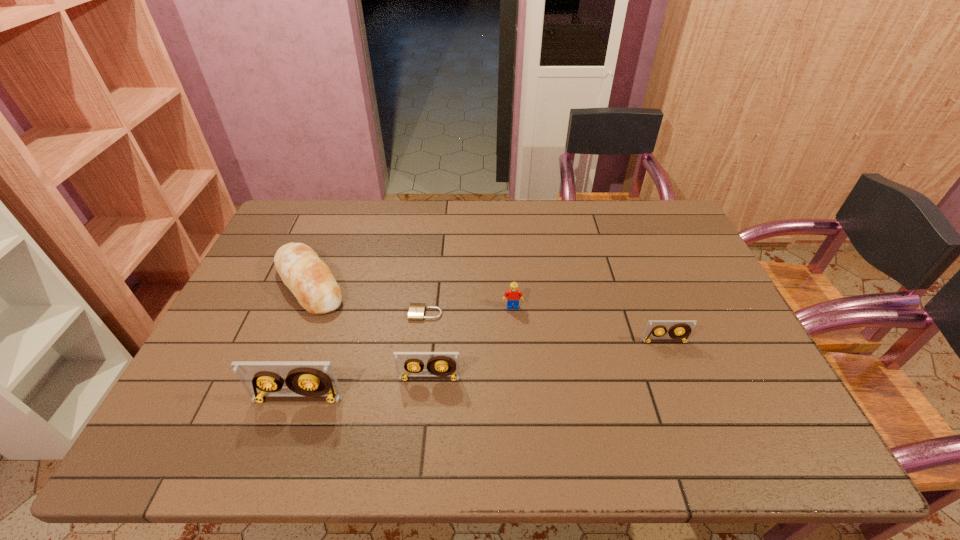
Locate an element on the screen. The image size is (960, 540). the leftmost videotape is located at coordinates click(x=306, y=380).

Identify the location of the tallest videotape. The height and width of the screenshot is (540, 960). (306, 380).

Locate an element on the screen. The image size is (960, 540). the second nearest videotape is located at coordinates (441, 365).

Locate an element on the screen. The height and width of the screenshot is (540, 960). the fifth farthest object is located at coordinates (441, 365).

Find the location of a particular element. This screenshot has height=540, width=960. the rightmost videotape is located at coordinates (679, 329).

At what (x,y) coordinates should I click in order to perform the action: click on the rightmost object. Please return your answer as a coordinate pair (x, y). Looking at the image, I should click on (679, 329).

This screenshot has width=960, height=540. Find the location of `bread`. bread is located at coordinates pyautogui.click(x=310, y=280).

I want to click on Lego, so click(x=513, y=295).

Where is `the shortest object`? the shortest object is located at coordinates (416, 310).

You are a GUI agent. You are given a task and a screenshot of the screen. Output one action in this format:
    pyautogui.click(x=<x>, y=<y>)
    Task: Click on the vacant point located at the front of the farthest videotape with visible reels
    This screenshot has width=960, height=540.
    Given the screenshot: What is the action you would take?
    tap(684, 390)